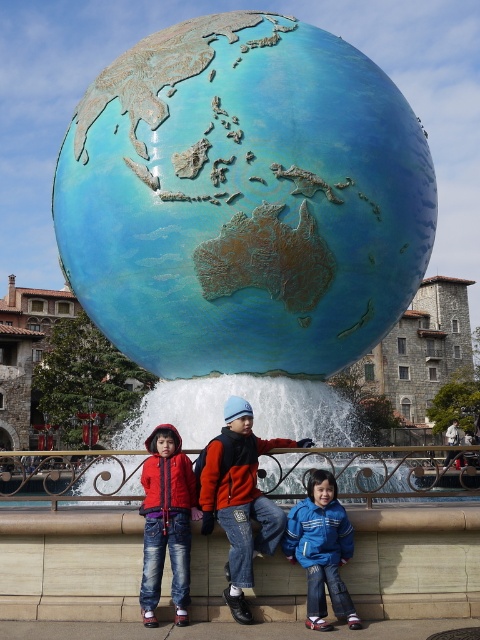
Question: Does smooth stone ledge at lower center come in front of denim jacket at lower left?

Choices:
 (A) yes
 (B) no

Answer: (B)

Question: Among these objects, which one is nearest to the camera?

Choices:
 (A) blue fleece jacket at lower right
 (B) blue patina globe at center

Answer: (A)

Question: Is matte blue beanie at center to the right of denim jacket at lower left from the viewer's perspective?

Choices:
 (A) no
 (B) yes

Answer: (B)

Question: Which point is farther from the camera taking this photo?

Choices:
 (A) (238, 561)
 (B) (468, 550)
 (C) (315, 620)

Answer: (B)

Question: Can you confirm if matte blue beanie at center is wider than denim jacket at lower left?

Choices:
 (A) yes
 (B) no

Answer: (A)

Question: Which object appears farthest from the camera in this image?

Choices:
 (A) denim jacket at lower left
 (B) blue patina globe at center

Answer: (B)